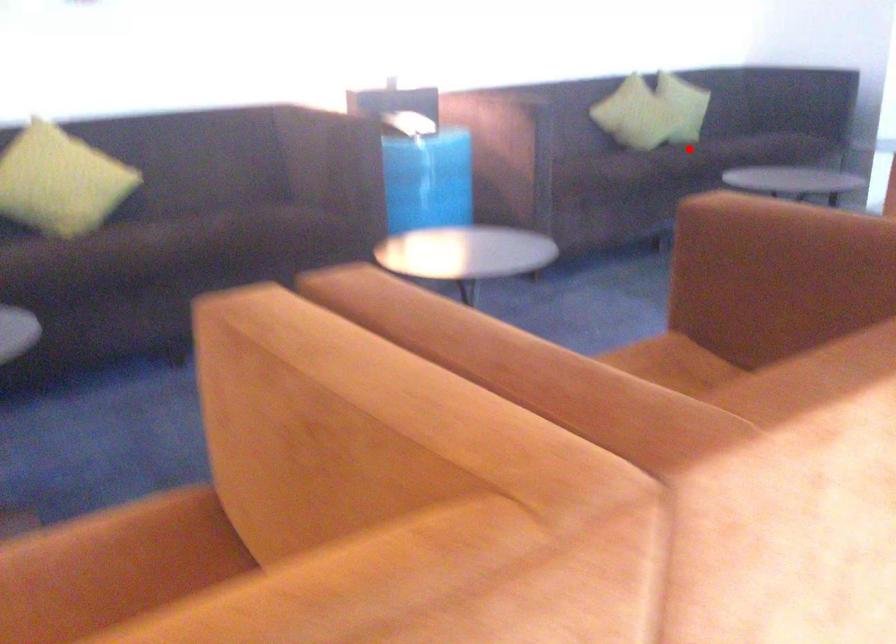
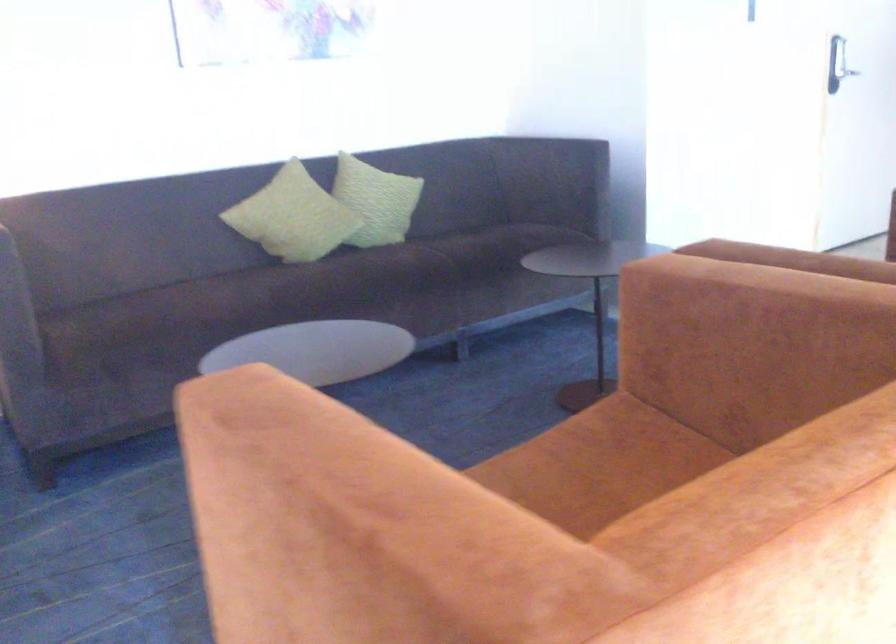
Question: I am providing you with two images of the same scene from different viewpoints. In image1, a red point is highlighted. Considering the same 3D point in image2, which of the following is correct?

Choices:
 (A) It is closer
 (B) It is farther

Answer: (A)